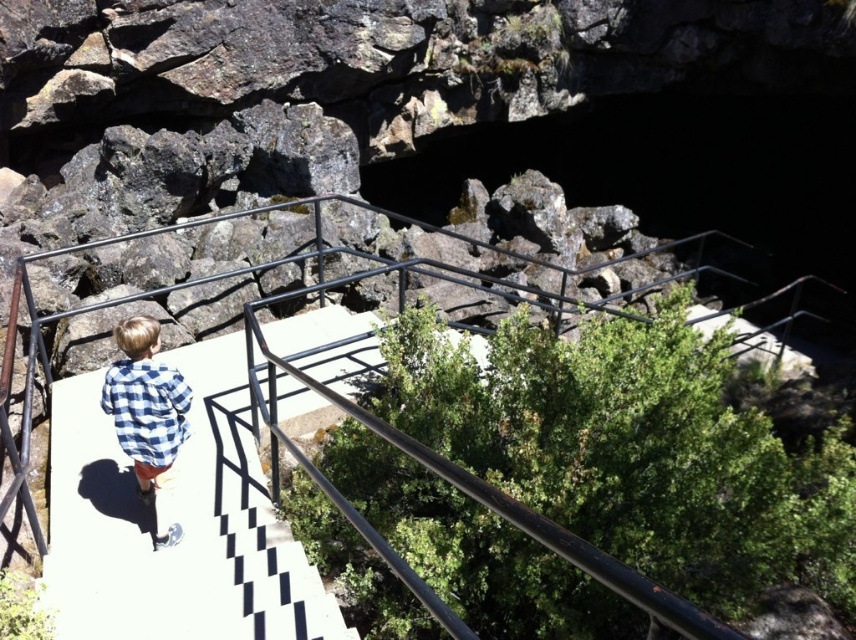
Does white checkered pavement at center have a greater height compared to black metal railing at center?

Yes, white checkered pavement at center is taller than black metal railing at center.

Which is above, white checkered pavement at center or black metal railing at center?

black metal railing at center

Looking at this image, measure the distance between white checkered pavement at center and camera.

A distance of 3.66 meters exists between white checkered pavement at center and camera.

The height and width of the screenshot is (640, 856). I want to click on white checkered pavement at center, so click(175, 520).

Is white checkered pavement at center shorter than blue checkered shirt at lower left?

Yes.

Does white checkered pavement at center have a greater width compared to blue checkered shirt at lower left?

Indeed, white checkered pavement at center has a greater width compared to blue checkered shirt at lower left.

Locate an element on the screen. Image resolution: width=856 pixels, height=640 pixels. white checkered pavement at center is located at coordinates (175, 520).

Locate an element on the screen. The width and height of the screenshot is (856, 640). white checkered pavement at center is located at coordinates (175, 520).

Which is in front, point (357, 528) or point (187, 435)?

Point (357, 528) is in front.

You are a GUI agent. You are given a task and a screenshot of the screen. Output one action in this format:
    pyautogui.click(x=<x>, y=<y>)
    Task: Click on the black metal railing at center
    The image size is (856, 640).
    Given the screenshot: What is the action you would take?
    pyautogui.click(x=432, y=465)

The image size is (856, 640). What are the coordinates of `black metal railing at center` in the screenshot? It's located at (432, 465).